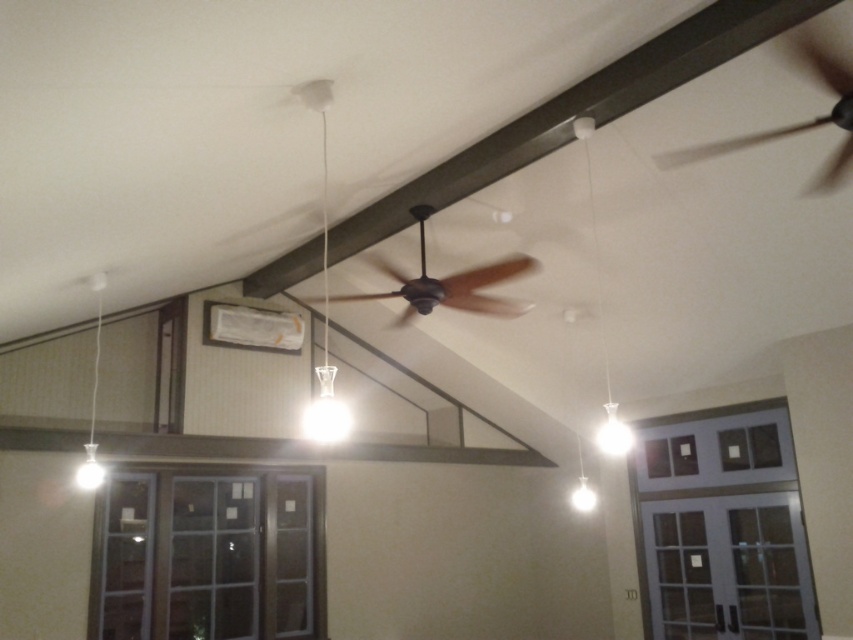
Question: Is white glass pendant light at center to the left of white glass pendant light at left from the viewer's perspective?

Choices:
 (A) yes
 (B) no

Answer: (B)

Question: Among these points, which one is farthest from the camera?

Choices:
 (A) (421, 246)
 (B) (322, 378)
 (C) (845, 164)

Answer: (A)

Question: Which point appears farthest from the camera in this image?

Choices:
 (A) (329, 100)
 (B) (473, 278)

Answer: (B)

Question: Is white glass light bulb at upper right to the left of white glass pendant light at left from the viewer's perspective?

Choices:
 (A) yes
 (B) no

Answer: (B)

Question: Estimate the real-world distances between objects in this image. Which object is farther from the black matte fan at upper center?

Choices:
 (A) brown matte fan at center
 (B) white glass light bulb at upper right

Answer: (B)

Question: Where is brown matte fan at center located in relation to white glass pendant light at left in the image?

Choices:
 (A) left
 (B) right

Answer: (B)